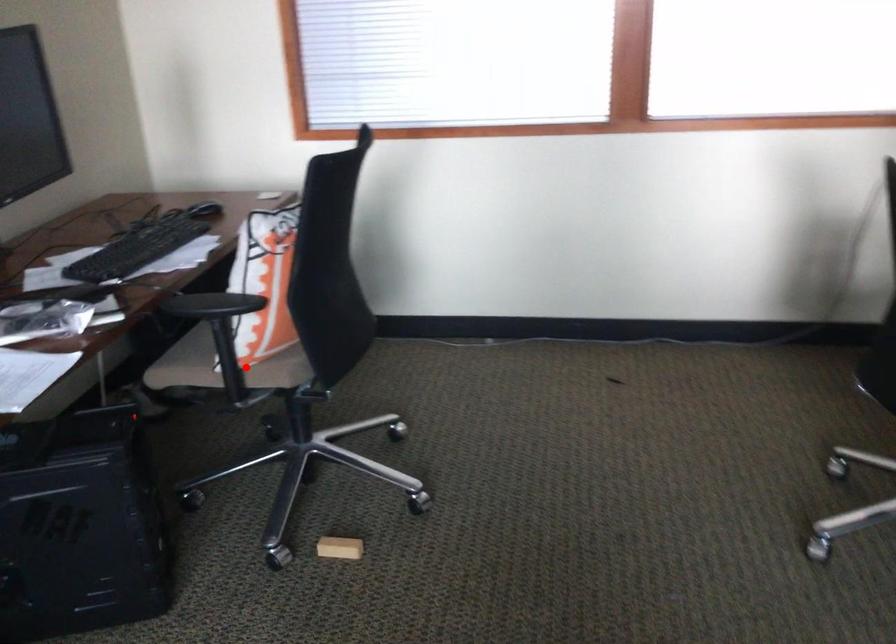
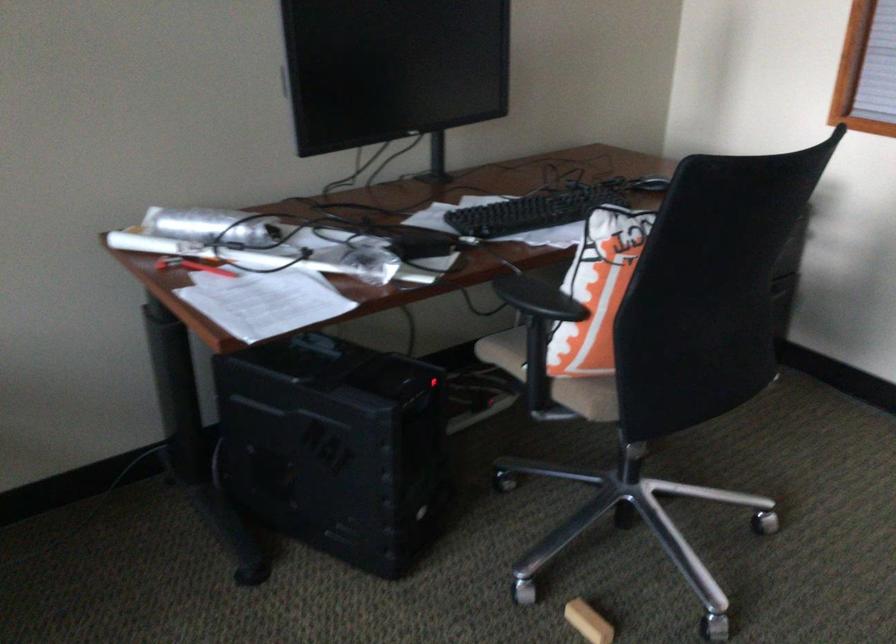
Question: I am providing you with two images of the same scene from different viewpoints. Image1 has a red point marked. In image2, the corresponding 3D location appears at what relative position? Reply with the corresponding letter.

Choices:
 (A) Closer
 (B) Farther

Answer: (A)